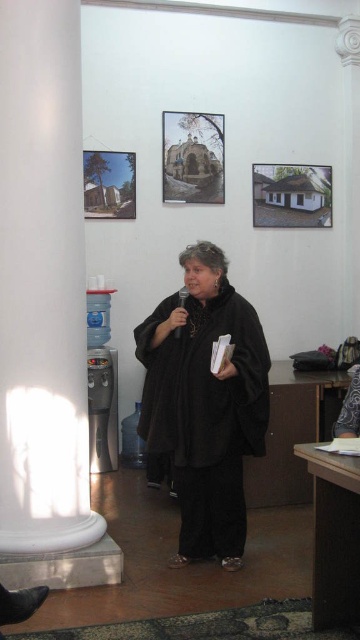
Question: Is white marble pillar at left wider than black matte coat at center?

Choices:
 (A) no
 (B) yes

Answer: (A)

Question: Among these points, which one is farthest from the camera?

Choices:
 (A) (227, 476)
 (B) (47, 330)

Answer: (A)

Question: Is white marble pillar at left bigger than black matte coat at center?

Choices:
 (A) yes
 (B) no

Answer: (A)

Question: Among these points, which one is nearest to the camera?

Choices:
 (A) (164, 321)
 (B) (21, 280)

Answer: (B)

Question: Is white marble pillar at left smaller than black matte coat at center?

Choices:
 (A) no
 (B) yes

Answer: (A)